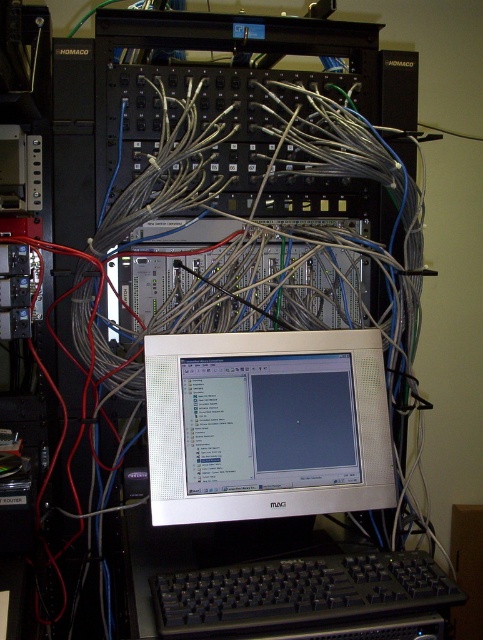
You are a technician who needs to access the keyboard to input commands. Given the layout of the server room, where should you position yourself relative to the white glossy monitor at center to reach the black plastic keyboard at lower center?

Since the white glossy monitor at center is to the left of the black plastic keyboard at lower center, you should position yourself to the right of the white glossy monitor at center to reach the keyboard.

Consider the image. You are a technician standing in the server room and need to locate the white glossy monitor at center. According to the coordinates provided, where would you find it?

The white glossy monitor at center is located at the 2D coordinates point (x=267, y=426).